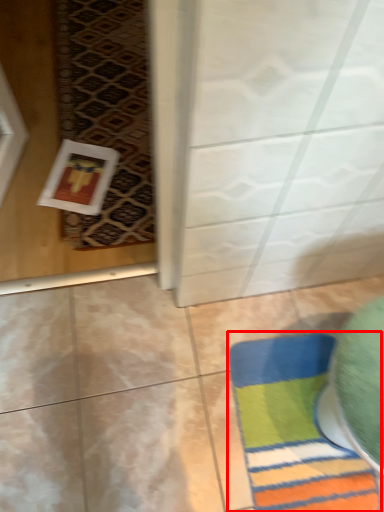
Question: From the image's perspective, considering the relative positions of bath mat (annotated by the red box) and mat in the image provided, where is bath mat (annotated by the red box) located with respect to the staircase?

Choices:
 (A) below
 (B) above

Answer: (A)